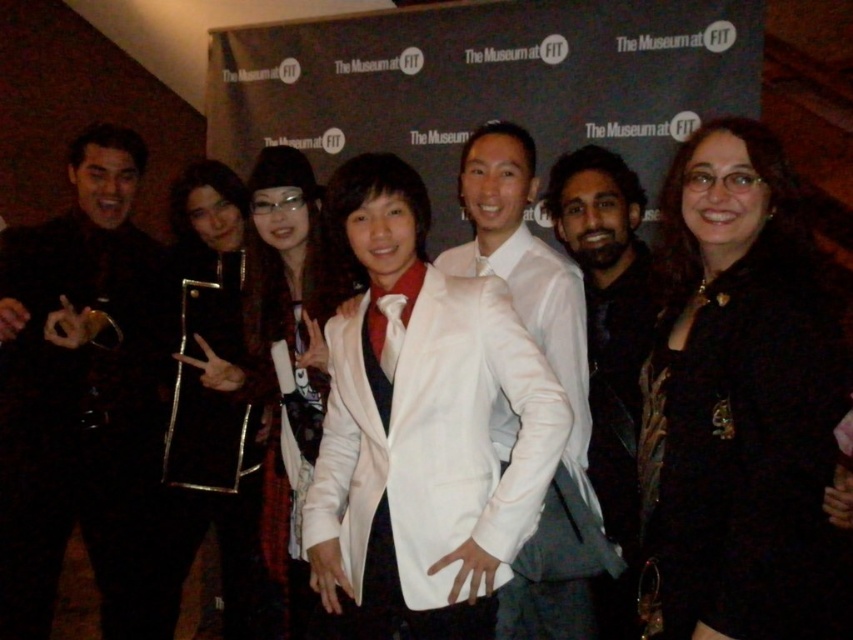
You are organizing a photo shoot and need to ensure that the white satin blazer at center and the metallic gold frame at center are visible in the final image. Based on their positions, which object is located to the right of the other?

The white satin blazer at center is positioned on the right side of metallic gold frame at center.

You are standing in front of the group photo at the formal event. There is a point marked at coordinates [432,449]. What object in the photo is located at this point?

The point at [432,449] corresponds to the white satin blazer at center.

You are standing at the point closest to the camera in the group photo. There are two points marked in the image, one at point (242, 278) and the other at point (293, 525). Which of these points is farther away from you?

Point (242, 278) is behind point (293, 525), so it is farther away from you.